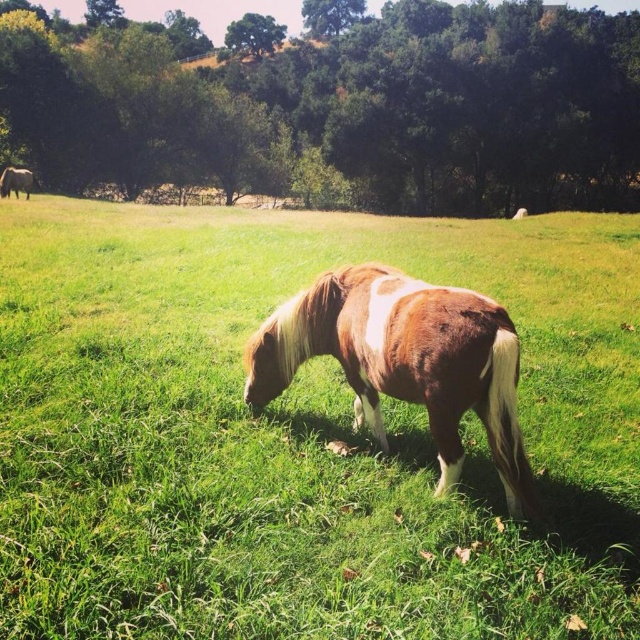
How distant is brown/white textured horse at center from brown glossy horse at upper left?

The distance of brown/white textured horse at center from brown glossy horse at upper left is 79.28 feet.

Between point (257, 400) and point (4, 179), which one is positioned in front?

Point (257, 400) is more forward.

Locate an element on the screen. This screenshot has width=640, height=640. brown/white textured horse at center is located at coordinates (404, 362).

Can you confirm if green grassy field at center is thinner than brown/white textured horse at center?

No.

Is point (484, 534) positioned before point (378, 317)?

Yes, point (484, 534) is in front of point (378, 317).

Who is more forward, (595, 304) or (442, 426)?

Point (442, 426)

Where is `green grassy field at center`? This screenshot has width=640, height=640. green grassy field at center is located at coordinates (300, 435).

Is green grassy field at center below brown glossy horse at upper left?

Yes.

Is green grassy field at center in front of brown glossy horse at upper left?

Yes, green grassy field at center is in front of brown glossy horse at upper left.

Locate an element on the screen. green grassy field at center is located at coordinates (300, 435).